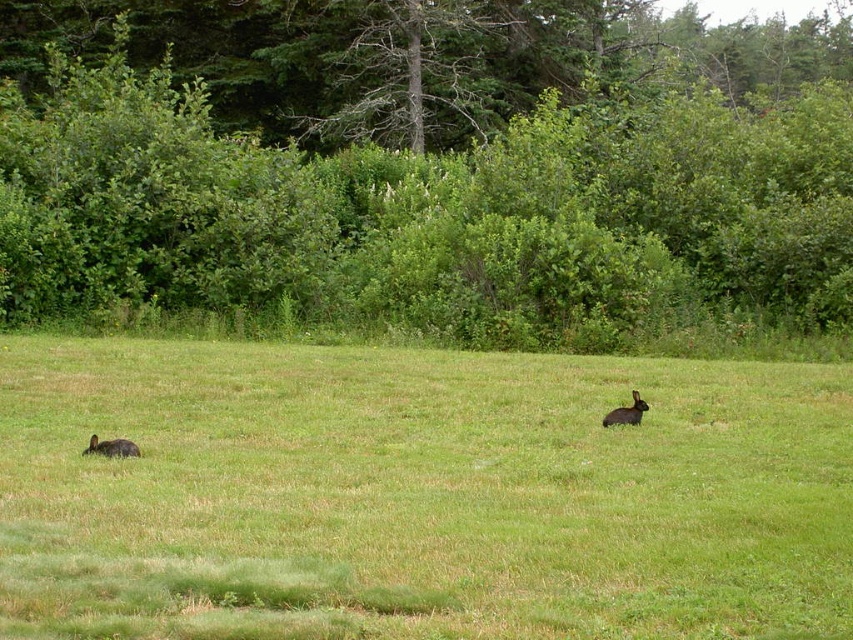
Question: Which is nearer to the green leafy tree at upper center?

Choices:
 (A) fuzzy brown rabbit at lower left
 (B) green grassy field at center

Answer: (B)

Question: Can you confirm if green leafy tree at upper center is positioned below fuzzy brown rabbit at center-right?

Choices:
 (A) no
 (B) yes

Answer: (A)

Question: Is green leafy bush at center closer to the viewer compared to green grassy field at center?

Choices:
 (A) no
 (B) yes

Answer: (A)

Question: Estimate the real-world distances between objects in this image. Which object is farther from the green leafy bush at center?

Choices:
 (A) fuzzy brown rabbit at center-right
 (B) green leafy tree at upper center
 (C) fuzzy brown rabbit at lower left

Answer: (C)

Question: Which is farther from the fuzzy brown rabbit at center-right?

Choices:
 (A) green leafy tree at upper center
 (B) green grassy field at center
 (C) fuzzy brown rabbit at lower left
 (D) green leafy bush at center

Answer: (A)

Question: From the image, what is the correct spatial relationship of green leafy bush at center in relation to fuzzy brown rabbit at center-right?

Choices:
 (A) below
 (B) above

Answer: (B)